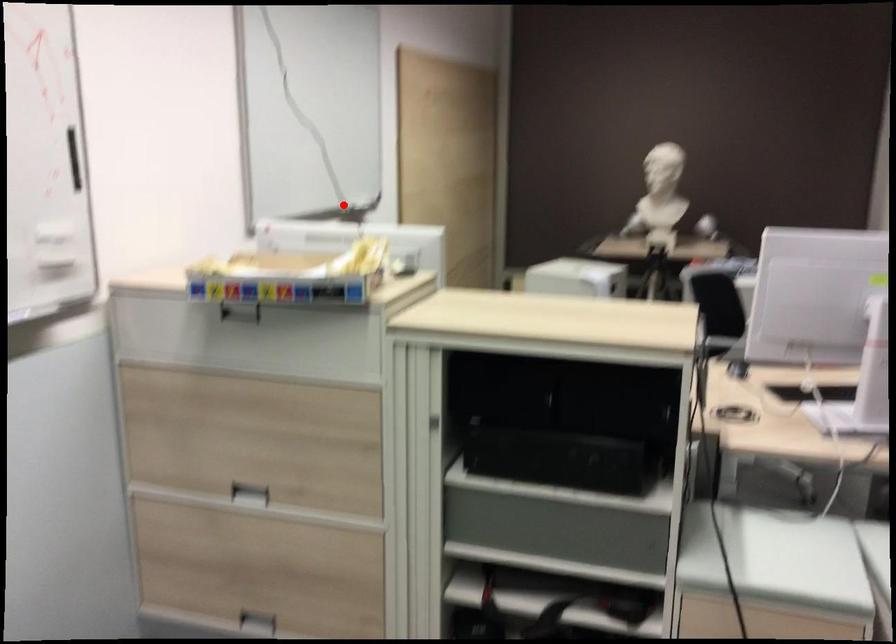
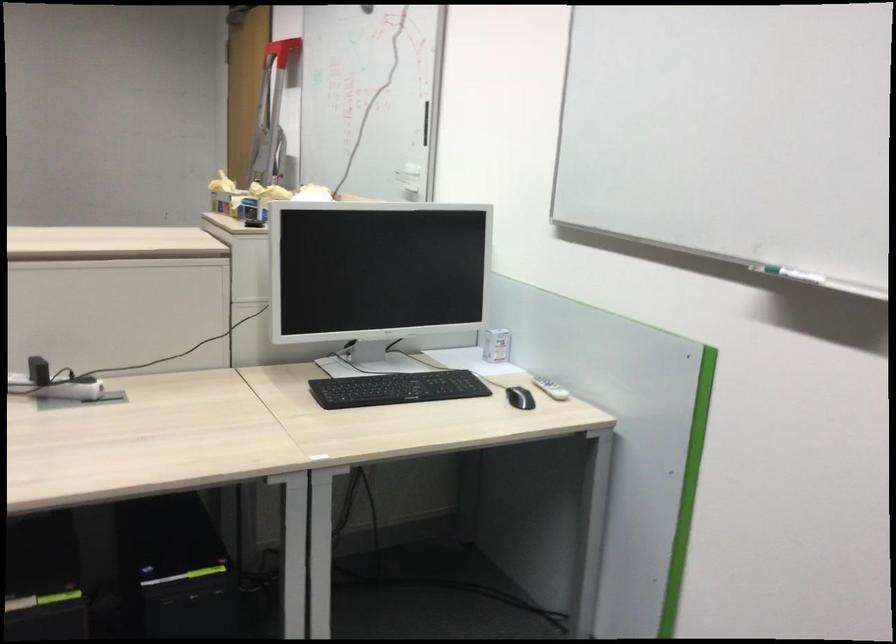
Question: I am providing you with two images of the same scene from different viewpoints. A red point is marked on the first image. Can you still see the location of the red point in image 2?

Choices:
 (A) Yes
 (B) No

Answer: (A)